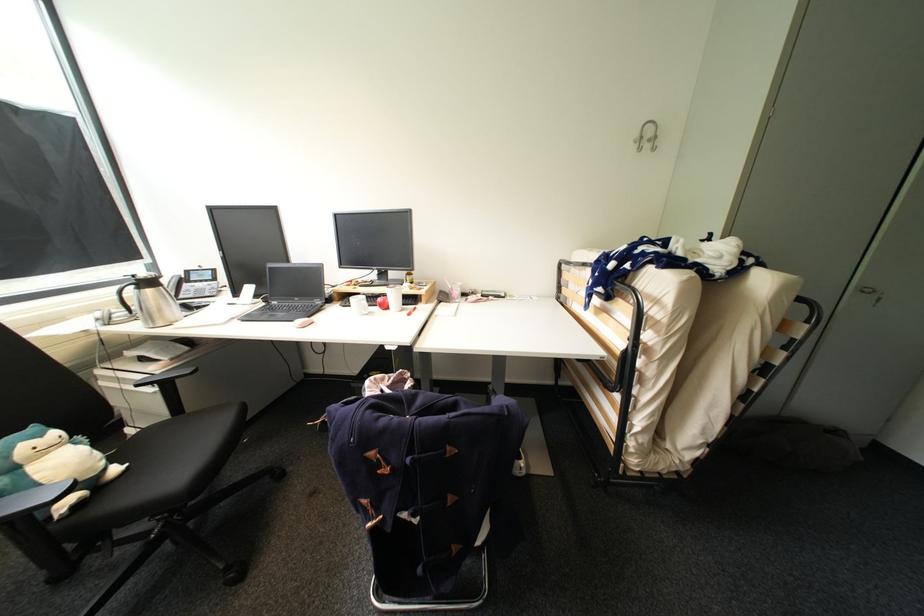
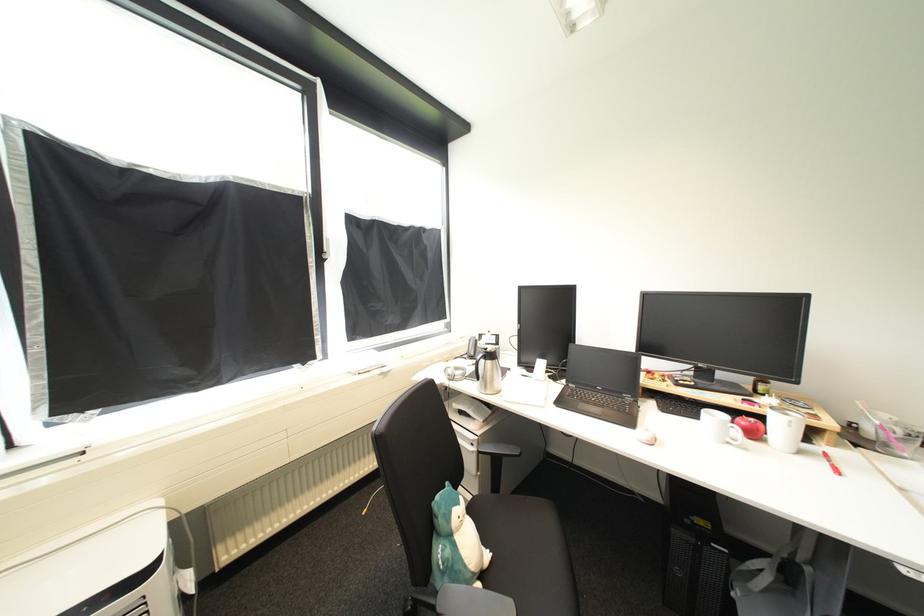
Find the pixel in the second image that matches (38,468) in the first image.

(464, 538)